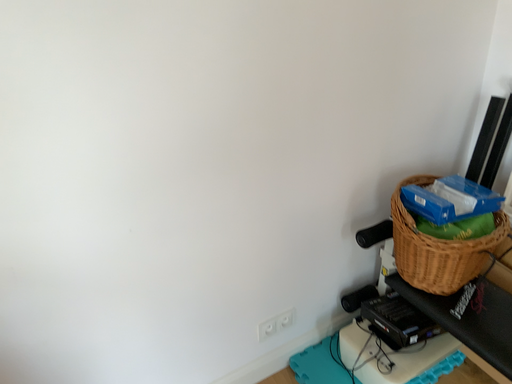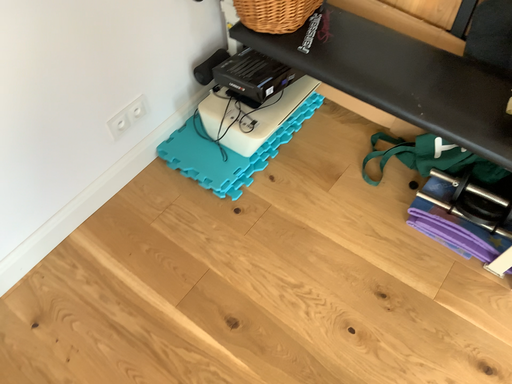
Question: Which way did the camera rotate in the video?

Choices:
 (A) rotated upward
 (B) rotated downward

Answer: (B)